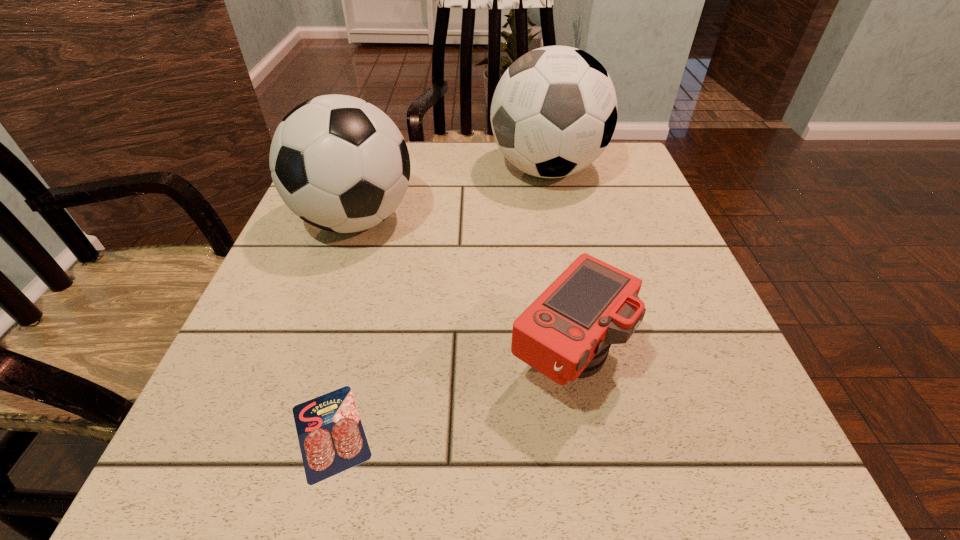
The width and height of the screenshot is (960, 540). What are the coordinates of `empty location between the third tallest object and the salami` in the screenshot? It's located at (449, 396).

I want to click on free space that is in between the salami and the right soccer ball, so click(439, 301).

Locate an element on the screen. This screenshot has width=960, height=540. free space between the third tallest object and the left soccer ball is located at coordinates pos(462,291).

Locate an element on the screen. This screenshot has width=960, height=540. vacant space that's between the shortest object and the camera is located at coordinates (449, 396).

The height and width of the screenshot is (540, 960). Find the location of `vacant space that's between the camera and the left soccer ball`. vacant space that's between the camera and the left soccer ball is located at coordinates (462, 291).

At what (x,y) coordinates should I click in order to perform the action: click on the third closest object to the left soccer ball. Please return your answer as a coordinate pair (x, y). This screenshot has height=540, width=960. Looking at the image, I should click on (331, 436).

Select which object is the second closest to the right soccer ball. Please provide its 2D coordinates. Your answer should be formatted as a tuple, i.e. [(x, y)], where the tuple contains the x and y coordinates of a point satisfying the conditions above.

[(565, 334)]

Identify the location of vacant space that satisfies the following two spatial constraints: 1. on the main logo of the right soccer ball; 2. on the front side of the shortest object. (601, 431).

Where is `free region that satisfies the following two spatial constraints: 1. on the main logo of the right soccer ball; 2. on the front side of the left soccer ball`? free region that satisfies the following two spatial constraints: 1. on the main logo of the right soccer ball; 2. on the front side of the left soccer ball is located at coordinates (557, 220).

Image resolution: width=960 pixels, height=540 pixels. What are the coordinates of `free spot that satisfies the following two spatial constraints: 1. on the main logo of the right soccer ball; 2. on the front side of the third tallest object` in the screenshot? It's located at (587, 361).